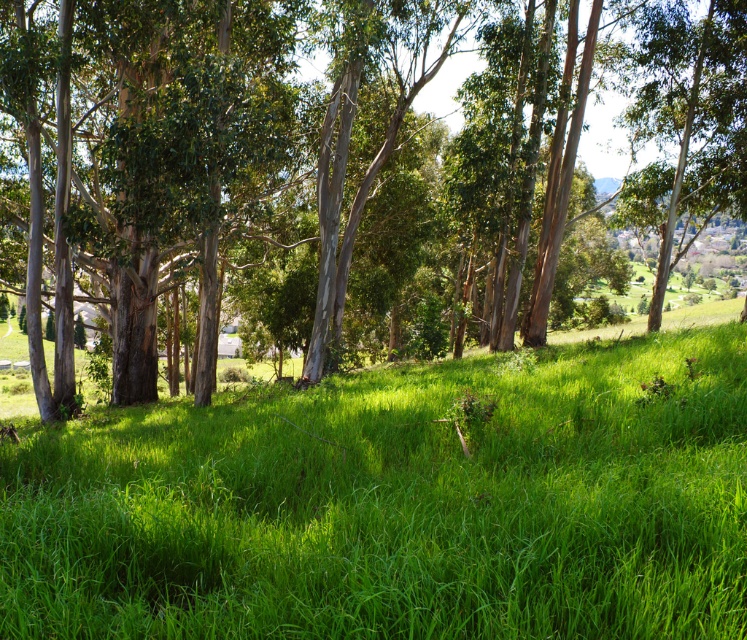
Does green grassy field at center have a lesser width compared to green smooth tree at center?

Correct, green grassy field at center's width is less than green smooth tree at center's.

How distant is green grassy field at center from green smooth tree at center?

green grassy field at center is 22.44 meters from green smooth tree at center.

Describe the element at coordinates (397, 504) in the screenshot. This screenshot has height=640, width=747. I see `green grassy field at center` at that location.

Locate an element on the screen. This screenshot has height=640, width=747. green grassy field at center is located at coordinates (397, 504).